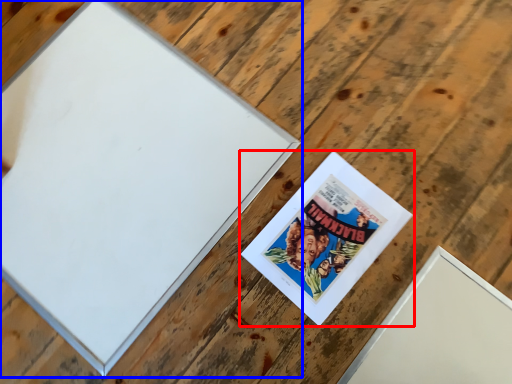
Question: Which object appears farthest to the camera in this image, picture frame (highlighted by a red box) or picture frame (highlighted by a blue box)?

Choices:
 (A) picture frame
 (B) picture frame

Answer: (A)